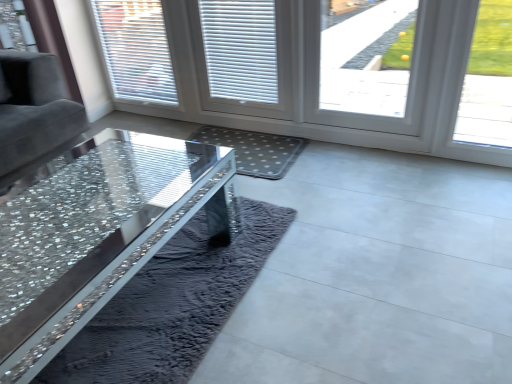
Locate an element on the screen. The height and width of the screenshot is (384, 512). vacant space in gray dotted mat at center (from a real-world perspective) is located at coordinates (253, 145).